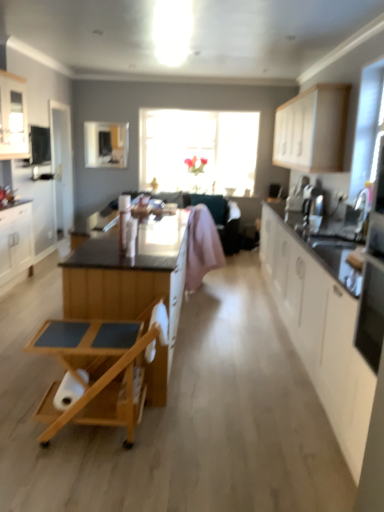
Question: Does white matte cabinet at right, the 2th cabinetry positioned from the right, have a larger size compared to white glossy cabinet at upper left, the 4th cabinetry in the right-to-left sequence?

Choices:
 (A) yes
 (B) no

Answer: (A)

Question: Is white matte cabinet at right, the 2th cabinetry positioned from the right, far from white glossy cabinet at upper left, the 4th cabinetry in the right-to-left sequence?

Choices:
 (A) no
 (B) yes

Answer: (B)

Question: Does white matte cabinet at right, the 2th cabinetry positioned from the right, have a greater height compared to white glossy cabinet at upper left, which is counted as the second cabinetry, starting from the left?

Choices:
 (A) no
 (B) yes

Answer: (B)

Question: Is white glossy cabinet at upper left, the 4th cabinetry in the right-to-left sequence, surrounded by white matte cabinet at right, the 2th cabinetry positioned from the right?

Choices:
 (A) yes
 (B) no

Answer: (B)

Question: From the image's perspective, does white matte cabinet at right, which is the 4th cabinetry in left-to-right order, appear lower than white glossy cabinet at upper left, which is counted as the second cabinetry, starting from the left?

Choices:
 (A) no
 (B) yes

Answer: (B)

Question: Does white matte cabinet at right, the 2th cabinetry positioned from the right, have a lesser width compared to white glossy cabinet at upper left, which is counted as the second cabinetry, starting from the left?

Choices:
 (A) yes
 (B) no

Answer: (B)

Question: Can you confirm if transparent glass window at center is thinner than white matte cabinet at right, which is the 4th cabinetry in left-to-right order?

Choices:
 (A) no
 (B) yes

Answer: (B)

Question: Is transparent glass window at center in contact with white matte cabinet at right, which is the 4th cabinetry in left-to-right order?

Choices:
 (A) yes
 (B) no

Answer: (B)

Question: Considering the relative sizes of transparent glass window at center and white matte cabinet at right, which is the 4th cabinetry in left-to-right order, in the image provided, is transparent glass window at center bigger than white matte cabinet at right, which is the 4th cabinetry in left-to-right order,?

Choices:
 (A) yes
 (B) no

Answer: (B)

Question: Considering the relative sizes of transparent glass window at center and white matte cabinet at right, which is the 4th cabinetry in left-to-right order, in the image provided, is transparent glass window at center taller than white matte cabinet at right, which is the 4th cabinetry in left-to-right order,?

Choices:
 (A) no
 (B) yes

Answer: (B)

Question: Considering the relative sizes of transparent glass window at center and white matte cabinet at right, the 2th cabinetry positioned from the right, in the image provided, is transparent glass window at center smaller than white matte cabinet at right, the 2th cabinetry positioned from the right,?

Choices:
 (A) no
 (B) yes

Answer: (B)

Question: Is transparent glass window at center at the left side of white matte cabinet at right, the 2th cabinetry positioned from the right?

Choices:
 (A) yes
 (B) no

Answer: (A)

Question: Does white glossy cabinet at upper left, the 4th cabinetry in the right-to-left sequence, turn towards white matte cabinet at upper right, placed as the first cabinetry when sorted from right to left?

Choices:
 (A) no
 (B) yes

Answer: (B)